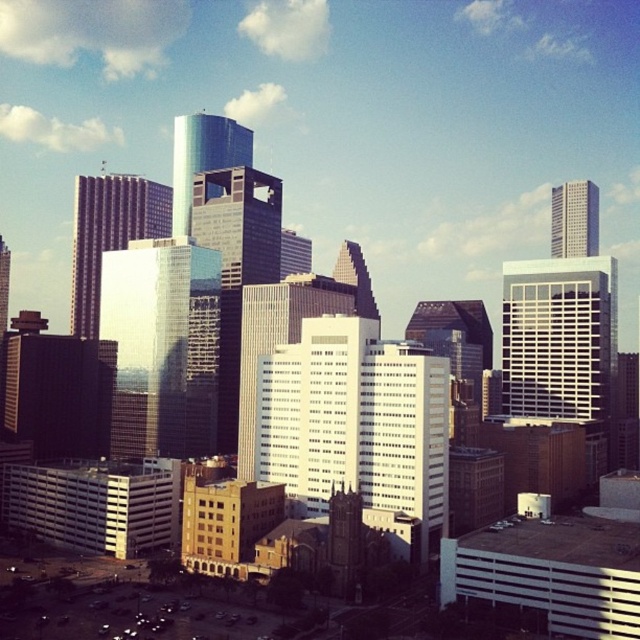
Who is positioned more to the right, white glass building at center or matte glass skyscraper at center-left?

From the viewer's perspective, white glass building at center appears more on the right side.

Is white glass building at center below matte glass skyscraper at center-left?

Yes.

Between point (316, 465) and point (97, 278), which one is positioned behind?

Point (97, 278)

The image size is (640, 640). Find the location of `white glass building at center`. white glass building at center is located at coordinates (356, 428).

Is point (276, 237) more distant than point (180, 184)?

No, it is in front of (180, 184).

Based on the photo, who is lower down, glassy reflective skyscraper at center or shiny glass skyscraper at center?

glassy reflective skyscraper at center

Who is more forward, [276,259] or [179,116]?

Positioned in front is point [276,259].

Find the location of `glassy reflective skyscraper at center`. glassy reflective skyscraper at center is located at coordinates (237, 221).

Between reflective glass skyscraper at center and white glass building at upper right, which one appears on the left side from the viewer's perspective?

reflective glass skyscraper at center

Between point (131, 445) and point (554, 244), which one is positioned behind?

Point (554, 244)

Locate an element on the screen. reflective glass skyscraper at center is located at coordinates (161, 344).